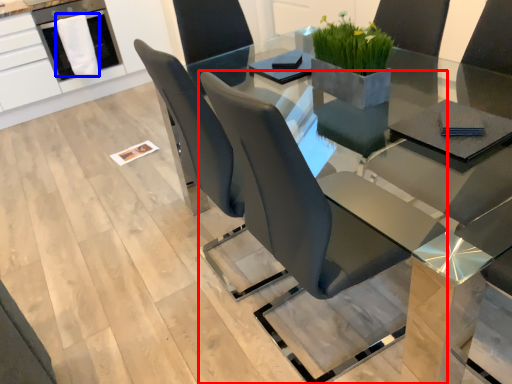
Question: Among these objects, which one is nearest to the camera, chair (highlighted by a red box) or cloth (highlighted by a blue box)?

Choices:
 (A) chair
 (B) cloth

Answer: (A)